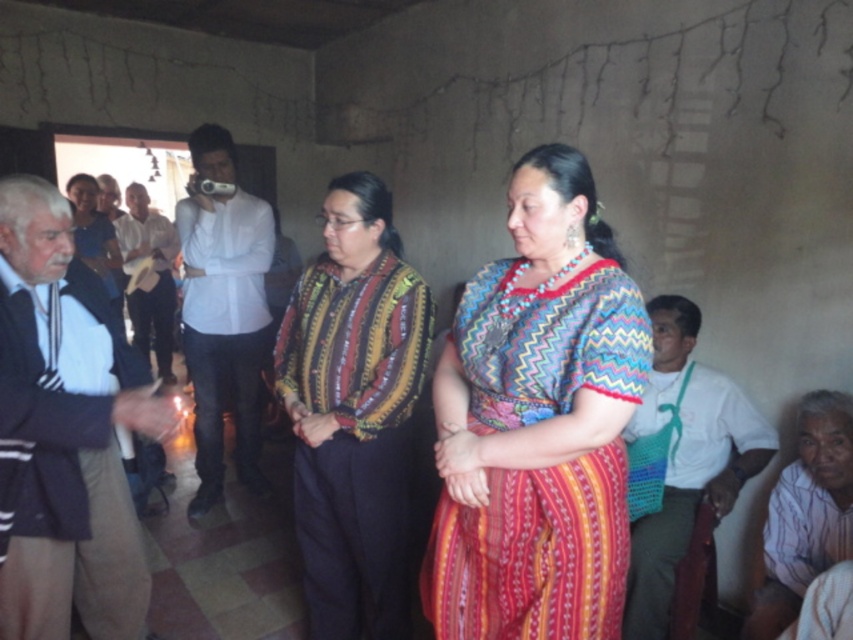
Find the location of a particular element. This screenshot has width=853, height=640. white woven bag at right is located at coordinates (682, 460).

Who is lower down, white woven bag at right or white smooth shirt at center?

white woven bag at right

The width and height of the screenshot is (853, 640). I want to click on white woven bag at right, so click(682, 460).

Image resolution: width=853 pixels, height=640 pixels. I want to click on white woven bag at right, so click(682, 460).

The height and width of the screenshot is (640, 853). What do you see at coordinates (805, 513) in the screenshot?
I see `white striped shirt at lower right` at bounding box center [805, 513].

Is white striped shirt at lower right smaller than white cotton shirt at center?

Correct, white striped shirt at lower right occupies less space than white cotton shirt at center.

Identify the location of white striped shirt at lower right. (805, 513).

Looking at this image, who is positioned more to the left, dark gray sweater at left or white striped shirt at lower right?

From the viewer's perspective, dark gray sweater at left appears more on the left side.

Does dark gray sweater at left have a lesser height compared to white striped shirt at lower right?

In fact, dark gray sweater at left may be taller than white striped shirt at lower right.

Locate an element on the screen. This screenshot has height=640, width=853. dark gray sweater at left is located at coordinates click(64, 435).